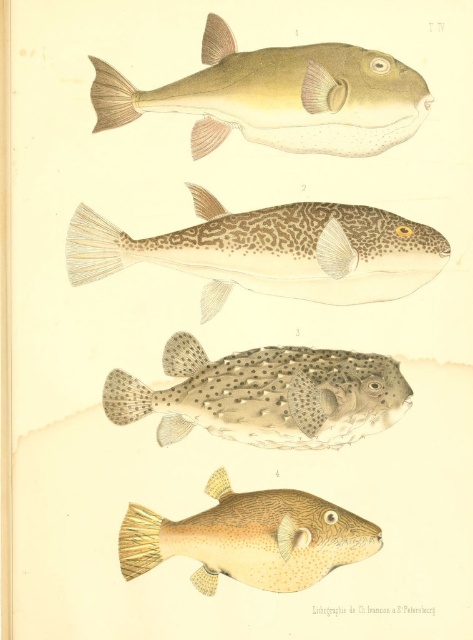
Question: Among these points, which one is nearest to the camera?

Choices:
 (A) (332, 512)
 (B) (295, 120)
 (C) (119, 392)
 (D) (209, 257)

Answer: (A)

Question: Is spotted brown skin at center in front of brown textured fish at bottom right?

Choices:
 (A) yes
 (B) no

Answer: (B)

Question: Among these objects, which one is farthest from the camera?

Choices:
 (A) brown textured fish at bottom right
 (B) spotted brown skin at center
 (C) speckled leather pufferfish at center

Answer: (C)

Question: From the image, what is the correct spatial relationship of matte green fish at upper center in relation to spotted brown skin at center?

Choices:
 (A) left
 (B) right

Answer: (B)

Question: Which object is closer to the camera taking this photo?

Choices:
 (A) matte green fish at upper center
 (B) brown textured fish at bottom right

Answer: (B)

Question: Does spotted brown skin at center appear under brown textured fish at bottom right?

Choices:
 (A) no
 (B) yes

Answer: (A)